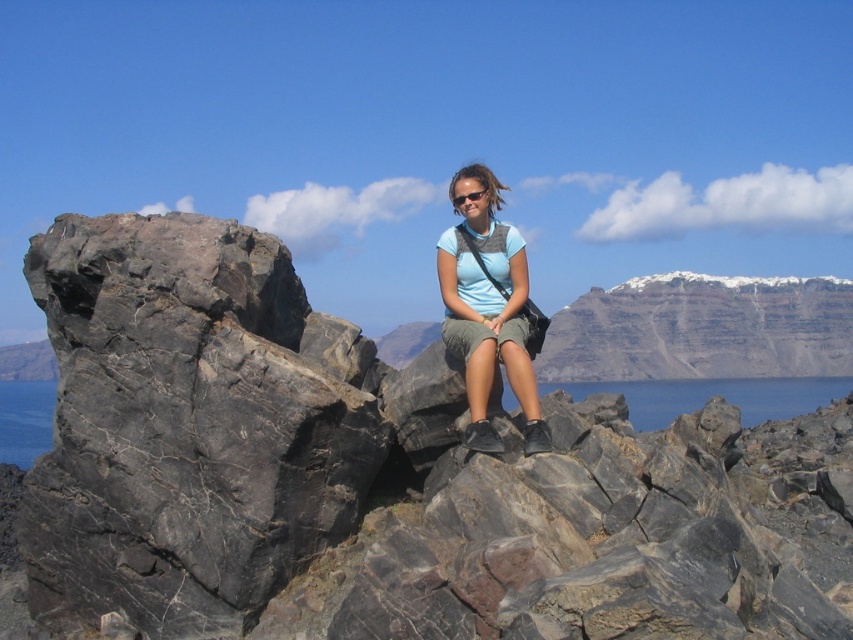
Between point (590, 285) and point (807, 403), which one is positioned behind?

Positioned behind is point (590, 285).

Can you confirm if smooth gray rock at center is taller than blue water at center?

Yes.

What are the coordinates of `smooth gray rock at center` in the screenshot? It's located at (701, 330).

You are a GUI agent. You are given a task and a screenshot of the screen. Output one action in this format:
    pyautogui.click(x=<x>, y=<y>)
    Task: Click on the smooth gray rock at center
    The image size is (853, 640).
    Given the screenshot: What is the action you would take?
    pyautogui.click(x=701, y=330)

Which is above, blue water at lower right or black plastic sunglasses at center?

black plastic sunglasses at center

Can you confirm if blue water at lower right is wider than black plastic sunglasses at center?

Indeed, blue water at lower right has a greater width compared to black plastic sunglasses at center.

Image resolution: width=853 pixels, height=640 pixels. I want to click on blue water at lower right, so click(712, 396).

Identify the location of blue water at lower right. This screenshot has height=640, width=853. (712, 396).

Can you confirm if black marble rock at center is wider than black plastic sunglasses at center?

Yes, black marble rock at center is wider than black plastic sunglasses at center.

Which is in front, point (71, 365) or point (476, 192)?

Point (71, 365) is more forward.

At what (x,y) coordinates should I click in order to perform the action: click on black marble rock at center. Please return your answer as a coordinate pair (x, y). The width and height of the screenshot is (853, 640). Looking at the image, I should click on (381, 476).